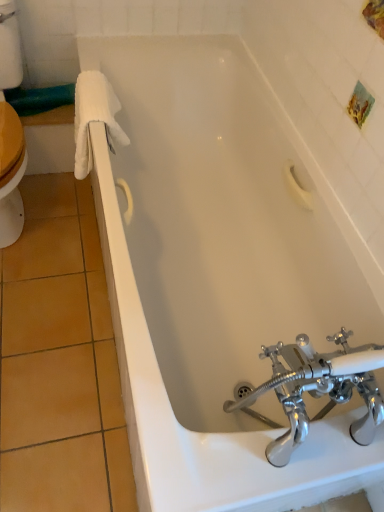
Measure the distance between white fluffy towel at left and camera.

white fluffy towel at left is 4.30 feet from camera.

Where is `white fluffy towel at left`? The height and width of the screenshot is (512, 384). white fluffy towel at left is located at coordinates (94, 117).

The height and width of the screenshot is (512, 384). Describe the element at coordinates (94, 117) in the screenshot. I see `white fluffy towel at left` at that location.

What is the approximate width of polished chrome faucet at bottom right?

The width of polished chrome faucet at bottom right is 26.84 centimeters.

What do you see at coordinates (317, 388) in the screenshot?
I see `polished chrome faucet at bottom right` at bounding box center [317, 388].

I want to click on polished chrome faucet at bottom right, so click(x=317, y=388).

Identify the location of white fluffy towel at left. Image resolution: width=384 pixels, height=512 pixels. (94, 117).

Which is more to the left, polished chrome faucet at bottom right or white fluffy towel at left?

Positioned to the left is white fluffy towel at left.

Is the depth of polished chrome faucet at bottom right greater than that of white fluffy towel at left?

No, it is in front of white fluffy towel at left.

Consider the image. Which is closer to the camera, (317, 353) or (94, 92)?

Clearly, point (317, 353) is closer to the camera than point (94, 92).

From the image's perspective, is polished chrome faucet at bottom right positioned above or below white fluffy towel at left?

polished chrome faucet at bottom right is situated lower than white fluffy towel at left in the image.

From a real-world perspective, is polished chrome faucet at bottom right on top of white fluffy towel at left?

Yes, from a real-world perspective, polished chrome faucet at bottom right is above white fluffy towel at left.

In the scene shown: Considering the relative sizes of polished chrome faucet at bottom right and white fluffy towel at left in the image provided, is polished chrome faucet at bottom right thinner than white fluffy towel at left?

Incorrect, the width of polished chrome faucet at bottom right is not less than that of white fluffy towel at left.

Considering the sizes of polished chrome faucet at bottom right and white fluffy towel at left in the image, is polished chrome faucet at bottom right taller or shorter than white fluffy towel at left?

Clearly, polished chrome faucet at bottom right is taller compared to white fluffy towel at left.

Considering the sizes of polished chrome faucet at bottom right and white fluffy towel at left in the image, is polished chrome faucet at bottom right bigger or smaller than white fluffy towel at left?

In the image, polished chrome faucet at bottom right appears to be larger than white fluffy towel at left.

Choose the correct answer: Is polished chrome faucet at bottom right inside white fluffy towel at left or outside it?

polished chrome faucet at bottom right cannot be found inside white fluffy towel at left.

Based on the photo, would you say polished chrome faucet at bottom right is a long distance from white fluffy towel at left?

Actually, polished chrome faucet at bottom right and white fluffy towel at left are a little close together.

Is polished chrome faucet at bottom right oriented towards white fluffy towel at left?

Yes, polished chrome faucet at bottom right is oriented towards white fluffy towel at left.

How far apart are polished chrome faucet at bottom right and white fluffy towel at left?

polished chrome faucet at bottom right and white fluffy towel at left are 37.96 inches apart from each other.

At what (x,y) coordinates should I click in order to perform the action: click on bath towel on the left of polished chrome faucet at bottom right. Please return your answer as a coordinate pair (x, y). Looking at the image, I should click on (94, 117).

Does white fluffy towel at left appear on the left side of polished chrome faucet at bottom right?

Yes, white fluffy towel at left is to the left of polished chrome faucet at bottom right.

Which is behind, white fluffy towel at left or polished chrome faucet at bottom right?

white fluffy towel at left is more distant.

Does point (106, 88) come in front of point (299, 335)?

No, (106, 88) is further to viewer.

From the image's perspective, which is below, white fluffy towel at left or polished chrome faucet at bottom right?

polished chrome faucet at bottom right is shown below in the image.

From a real-world perspective, which is physically below, white fluffy towel at left or polished chrome faucet at bottom right?

white fluffy towel at left.

Considering the relative sizes of white fluffy towel at left and polished chrome faucet at bottom right in the image provided, is white fluffy towel at left wider than polished chrome faucet at bottom right?

No, white fluffy towel at left is not wider than polished chrome faucet at bottom right.

Between white fluffy towel at left and polished chrome faucet at bottom right, which one has less height?

white fluffy towel at left is shorter.

Is white fluffy towel at left smaller than polished chrome faucet at bottom right?

Indeed, white fluffy towel at left has a smaller size compared to polished chrome faucet at bottom right.

Can we say white fluffy towel at left lies outside polished chrome faucet at bottom right?

white fluffy towel at left is positioned outside polished chrome faucet at bottom right.

Is white fluffy towel at left not near polished chrome faucet at bottom right?

They are positioned close to each other.

Looking at this image, is white fluffy towel at left positioned with its back to polished chrome faucet at bottom right?

No, white fluffy towel at left is not facing away from polished chrome faucet at bottom right.

What's the angular difference between white fluffy towel at left and polished chrome faucet at bottom right's facing directions?

The angle between the facing direction of white fluffy towel at left and the facing direction of polished chrome faucet at bottom right is 93.3 degrees.

You are a GUI agent. You are given a task and a screenshot of the screen. Output one action in this format:
    pyautogui.click(x=<x>, y=<y>)
    Task: Click on the bath towel above the polished chrome faucet at bottom right (from the image's perspective)
    Image resolution: width=384 pixels, height=512 pixels.
    Given the screenshot: What is the action you would take?
    pyautogui.click(x=94, y=117)

This screenshot has height=512, width=384. What are the coordinates of `tap that appears in front of the white fluffy towel at left` in the screenshot? It's located at (317, 388).

Where is `tap located on the right of white fluffy towel at left`? The width and height of the screenshot is (384, 512). tap located on the right of white fluffy towel at left is located at coordinates (317, 388).